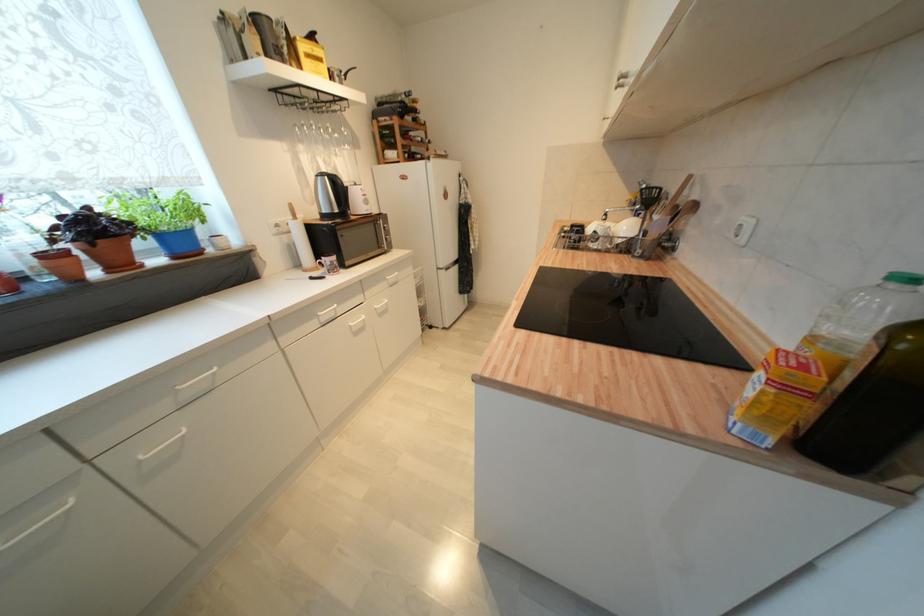
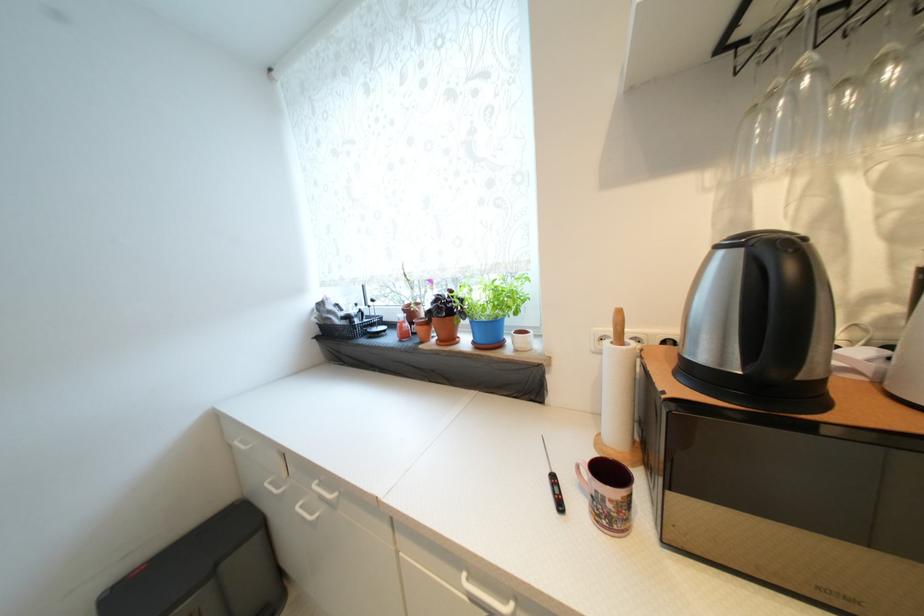
Where in the second image is the point corresponding to (322,177) from the first image?

(723, 249)